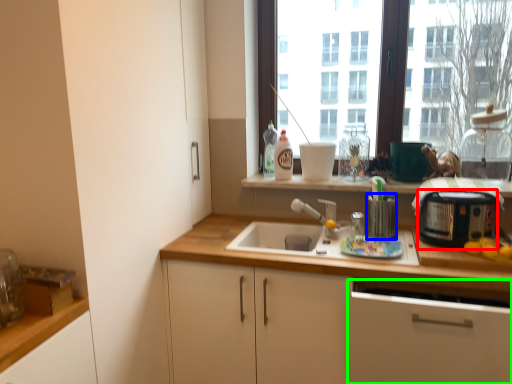
Question: Considering the real-world distances, which object is closest to appliance (highlighted by a red box)? appliance (highlighted by a blue box) or cabinetry (highlighted by a green box).

Choices:
 (A) appliance
 (B) cabinetry

Answer: (A)